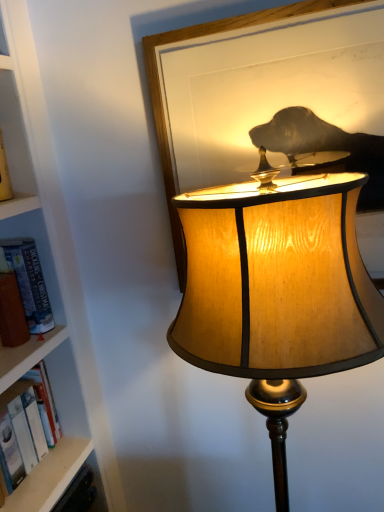
Question: Is the position of wooden lampshade at center less distant than that of hardcover book at left?

Choices:
 (A) yes
 (B) no

Answer: (A)

Question: Does wooden lampshade at center appear on the left side of hardcover book at left?

Choices:
 (A) no
 (B) yes

Answer: (A)

Question: Is wooden lampshade at center not close to hardcover book at left?

Choices:
 (A) no
 (B) yes

Answer: (A)

Question: Does wooden lampshade at center have a greater height compared to hardcover book at left?

Choices:
 (A) yes
 (B) no

Answer: (A)

Question: Is hardcover book at left surrounded by wooden lampshade at center?

Choices:
 (A) no
 (B) yes

Answer: (A)

Question: From a real-world perspective, is wooden lampshade at center above or below wooden frame at upper center?

Choices:
 (A) above
 (B) below

Answer: (B)

Question: Considering the relative positions of wooden lampshade at center and wooden frame at upper center in the image provided, is wooden lampshade at center to the left or to the right of wooden frame at upper center?

Choices:
 (A) right
 (B) left

Answer: (A)

Question: Considering the positions of wooden lampshade at center and wooden frame at upper center in the image, is wooden lampshade at center wider or thinner than wooden frame at upper center?

Choices:
 (A) thin
 (B) wide

Answer: (B)

Question: Does point (327, 209) appear closer or farther from the camera than point (327, 153)?

Choices:
 (A) farther
 (B) closer

Answer: (B)

Question: Based on their positions, is hardcover book at left located to the left or right of wooden lampshade at center?

Choices:
 (A) right
 (B) left

Answer: (B)

Question: In terms of width, does hardcover book at left look wider or thinner when compared to wooden lampshade at center?

Choices:
 (A) thin
 (B) wide

Answer: (A)

Question: Is hardcover book at left inside the boundaries of wooden lampshade at center, or outside?

Choices:
 (A) outside
 (B) inside

Answer: (A)

Question: In terms of height, does hardcover book at left look taller or shorter compared to wooden lampshade at center?

Choices:
 (A) short
 (B) tall

Answer: (A)

Question: Relative to hardcover book at left, is wooden frame at upper center in front or behind?

Choices:
 (A) behind
 (B) front

Answer: (B)

Question: In terms of width, does wooden frame at upper center look wider or thinner when compared to hardcover book at left?

Choices:
 (A) wide
 (B) thin

Answer: (B)